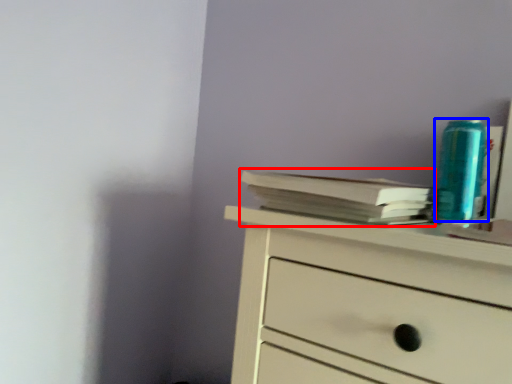
Question: Which point is further to the camera, paperback book (highlighted by a red box) or teal (highlighted by a blue box)?

Choices:
 (A) paperback book
 (B) teal

Answer: (B)